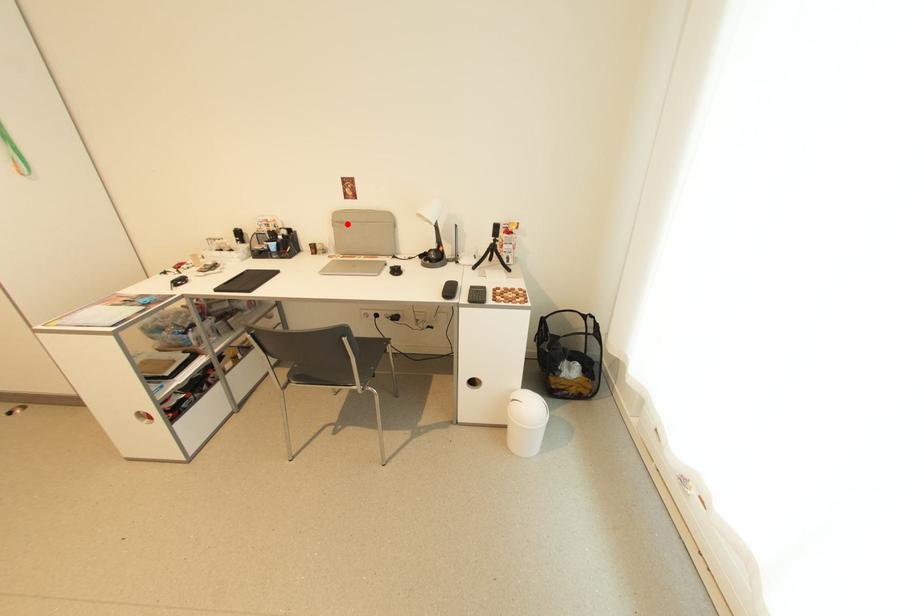
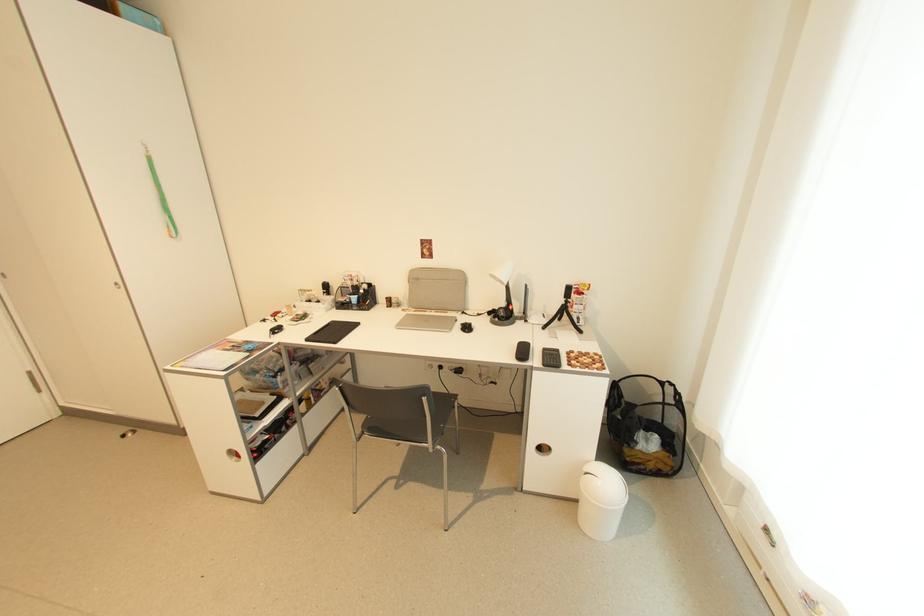
Locate, in the second image, the point that corresponds to the highlighted location in the first image.

(422, 281)